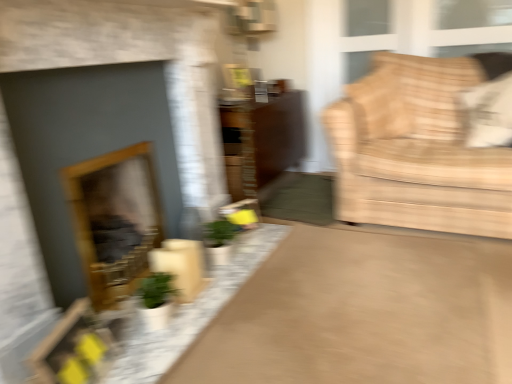
Question: Is beige fabric couch at right bigger or smaller than matte gray fireplace at left, the first fireplace from the front?

Choices:
 (A) small
 (B) big

Answer: (B)

Question: Choose the correct answer: Is beige fabric couch at right inside matte gray fireplace at left, the first fireplace from the front, or outside it?

Choices:
 (A) inside
 (B) outside

Answer: (B)

Question: Which object is positioned farthest from the matte brown dresser at center?

Choices:
 (A) matte gray fireplace at left, the first fireplace from the front
 (B) beige fabric couch at right
 (C) wooden frame fireplace at left, which ranks as the 2th fireplace in front-to-back order
 (D) matte brown rug at center
 (E) metallic silver picture frame at upper center

Answer: (D)

Question: Which object is positioned farthest from the matte gray fireplace at left, the first fireplace from the front?

Choices:
 (A) white fabric pillow at upper right
 (B) matte brown rug at center
 (C) wooden frame fireplace at left, positioned as the first fireplace in back-to-front order
 (D) beige fabric couch at right
 (E) matte brown dresser at center

Answer: (A)